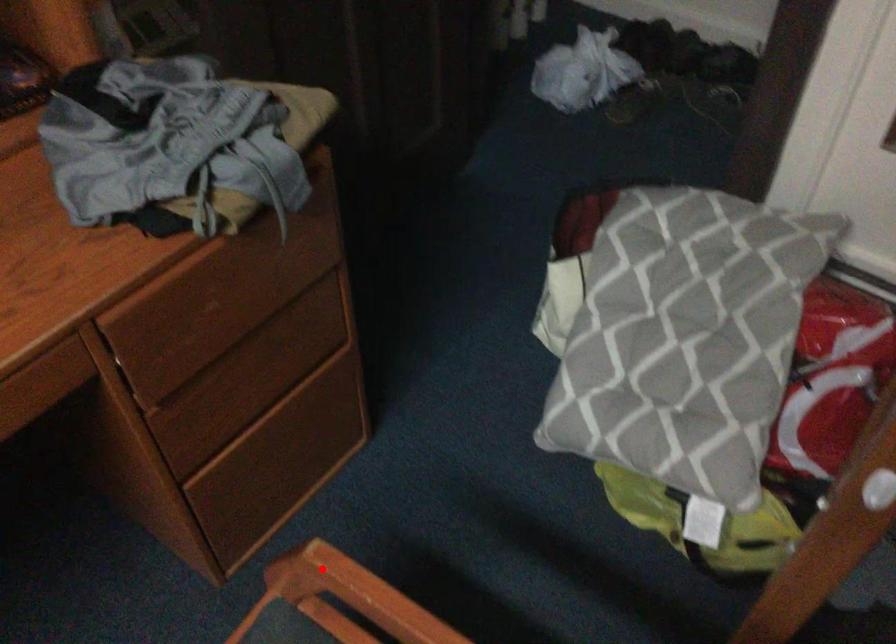
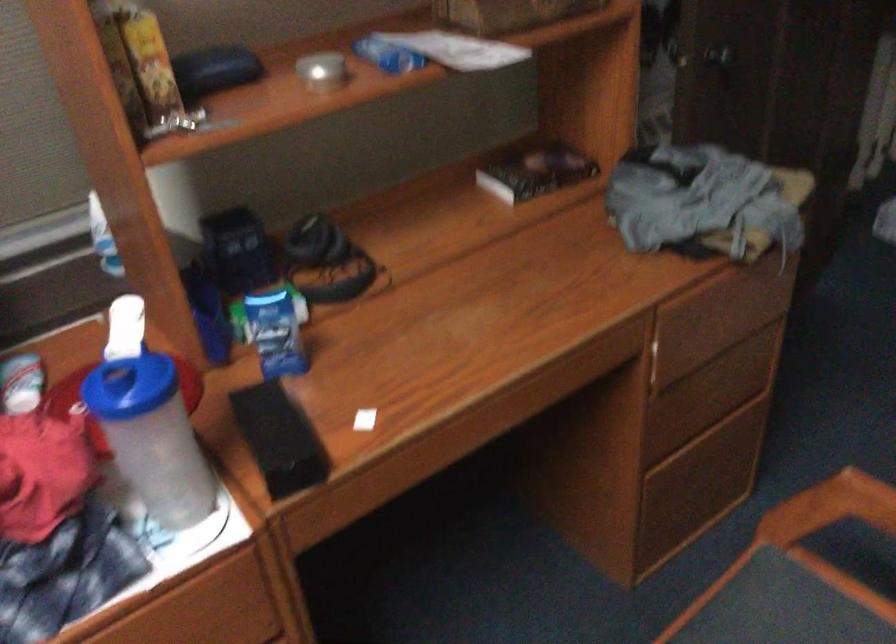
Question: I am providing you with two images of the same scene from different viewpoints. In image1, a red point is highlighted. Considering the same 3D point in image2, which of the following is correct?

Choices:
 (A) It is closer
 (B) It is farther

Answer: (B)